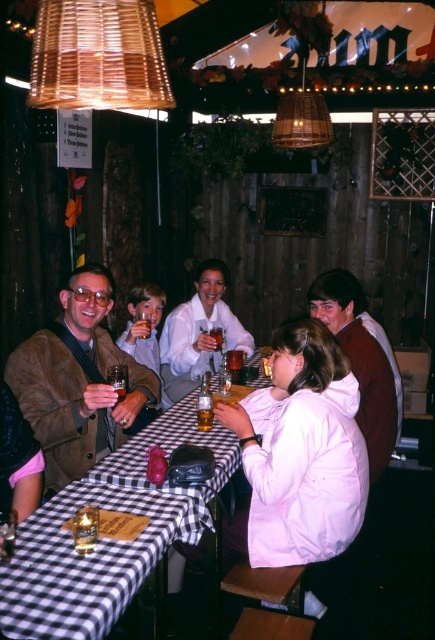
Which is more to the left, translucent glass beverage at table center or translucent glass beer at center?

translucent glass beer at center is more to the left.

Locate an element on the screen. This screenshot has width=435, height=640. translucent glass beverage at table center is located at coordinates (204, 419).

Is point (26, 595) farther from viewer compared to point (147, 336)?

No, it is in front of (147, 336).

Who is taller, black checkered tablecloth at lower left or translucent glass beer at center?

Standing taller between the two is black checkered tablecloth at lower left.

Does point (180, 520) lie in front of point (150, 321)?

Yes.

This screenshot has width=435, height=640. Find the location of `black checkered tablecloth at lower left`. black checkered tablecloth at lower left is located at coordinates (90, 561).

Is black checkered tablecloth at lower left to the left of white matte jacket at center from the viewer's perspective?

Yes, black checkered tablecloth at lower left is to the left of white matte jacket at center.

What do you see at coordinates (90, 561) in the screenshot? This screenshot has width=435, height=640. I see `black checkered tablecloth at lower left` at bounding box center [90, 561].

The height and width of the screenshot is (640, 435). In order to click on black checkered tablecloth at lower left in this screenshot , I will do `click(90, 561)`.